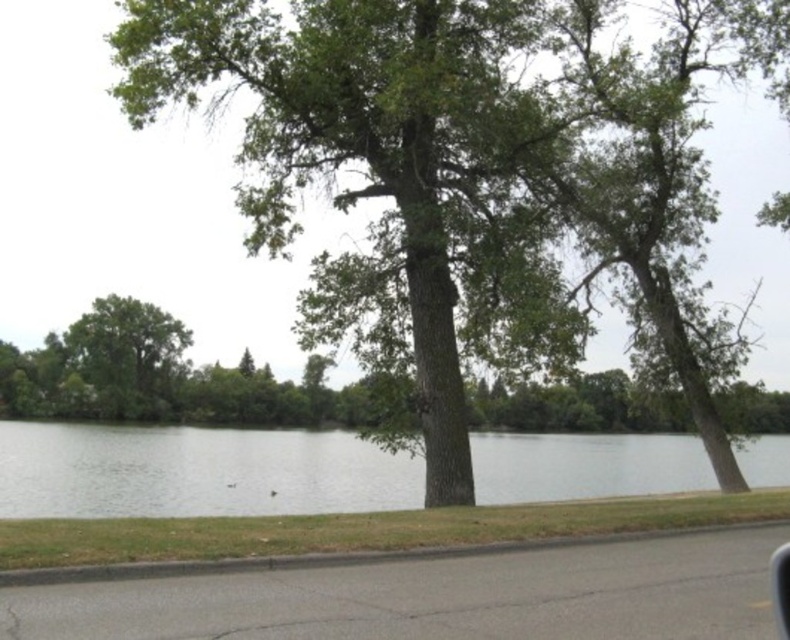
You are standing at the lakeside and want to walk directly to the green leafy tree at left. Given that the average human walking pace is 3 miles per hour, how many minutes would it take to reach the tree?

The distance between you and the green leafy tree at left is 223.53 feet. Converting this to miles, 223.53 feet is approximately 0.0423 miles. At a walking pace of 3 miles per hour, the time required would be distance divided by speed, so 0.0423 miles divided by 3 mph equals approximately 0.0141 hours. Converting hours to minutes by multiplying by 60 gives roughly 0.846 minutes, which is about 51 seconds. Therefore, it would take approximately 51 seconds to reach the green leafy tree at left.

You are a hiker standing on the paved road near the curb. You want to take a photo of both the green leafy tree at center and the clear water at center. Which object should you position to your left to include both in the frame?

The green leafy tree at center is positioned on the right side of clear water at center. To include both in the frame, position the clear water at center to your left so the tree appears on the right side of the water in the photo.

Based on the photo, you are a bird flying over the lakeside scene. You want to land on a spot that offers a clear view of the lake without obstruction. Which object between the green leafy tree at left and the transparent glass car window at lower right would allow you to see the lake better?

The transparent glass car window at lower right allows a clearer view of the lake since it is lower and not obstructed by the much taller green leafy tree at left.